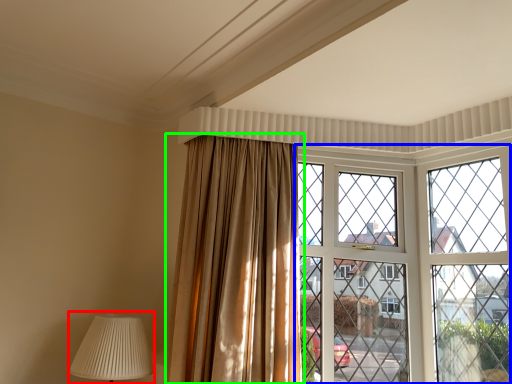
Question: Considering the real-world distances, which object is farthest from table lamp (highlighted by a red box)? window (highlighted by a blue box) or curtain (highlighted by a green box)?

Choices:
 (A) window
 (B) curtain

Answer: (A)